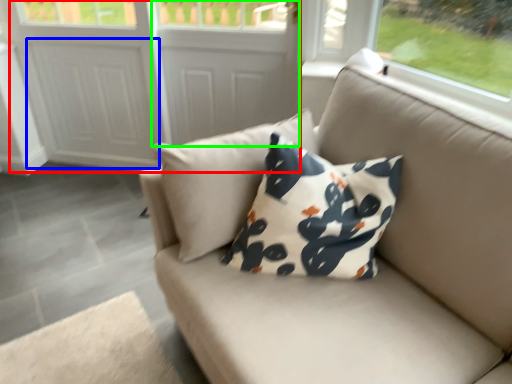
Question: Which object is positioned farthest from screen door (highlighted by a red box)? Select from screen door (highlighted by a blue box) and screen door (highlighted by a green box).

Choices:
 (A) screen door
 (B) screen door

Answer: (B)